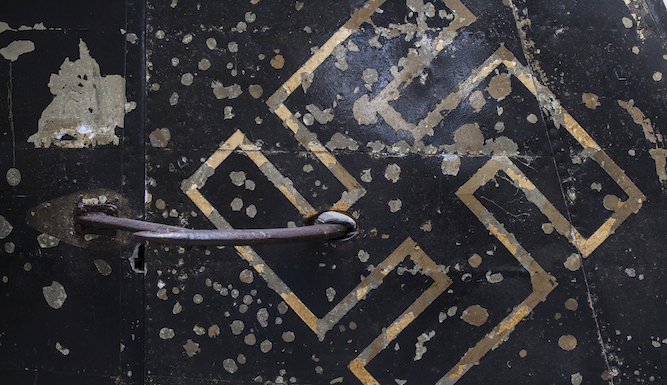
In order to click on 4 screws in this screenshot , I will do `click(77, 210)`, `click(109, 210)`, `click(111, 230)`, `click(77, 227)`.